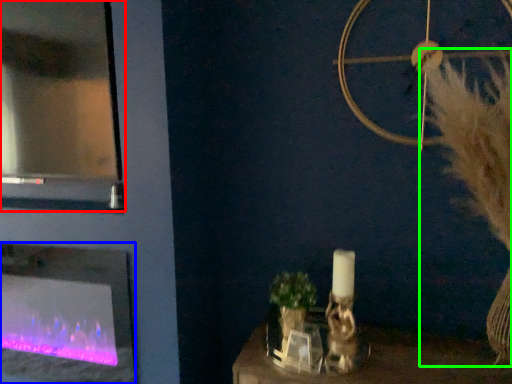
Question: Which object is positioned farthest from glass door (highlighted by a red box)? Select from fireplace (highlighted by a blue box) and fur (highlighted by a green box).

Choices:
 (A) fireplace
 (B) fur

Answer: (B)